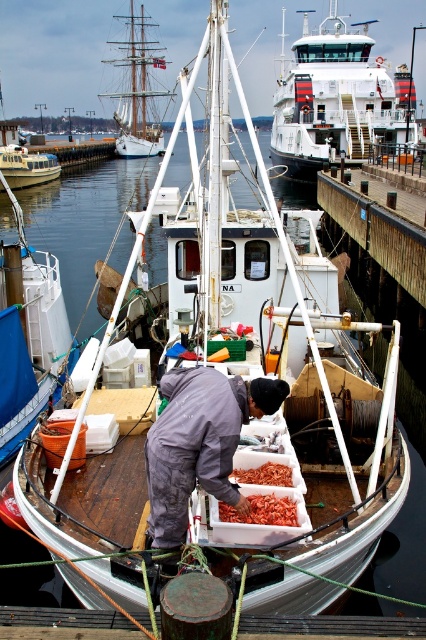
Question: Estimate the real-world distances between objects in this image. Which object is farther from the white plastic boat at center?

Choices:
 (A) white glossy ferry at center
 (B) wooden planks at lower center
 (C) orange fleshed shrimp at center

Answer: (A)

Question: Which point appears farthest from the camera in this image?

Choices:
 (A) 250,394
 (B) 255,506
 (C) 301,36
 (D) 138,109

Answer: (C)

Question: Where is wooden planks at lower center located in relation to white wooden boat at center in the image?

Choices:
 (A) right
 (B) left

Answer: (A)

Question: Does white plastic boat at center have a greater width compared to white wooden ship at upper left?

Choices:
 (A) no
 (B) yes

Answer: (A)

Question: Which point appears closest to the camera in this image?

Choices:
 (A) [123, 115]
 (B) [285, 484]

Answer: (B)

Question: Can you confirm if white glossy ferry at center is smaller than wooden planks at lower center?

Choices:
 (A) yes
 (B) no

Answer: (B)